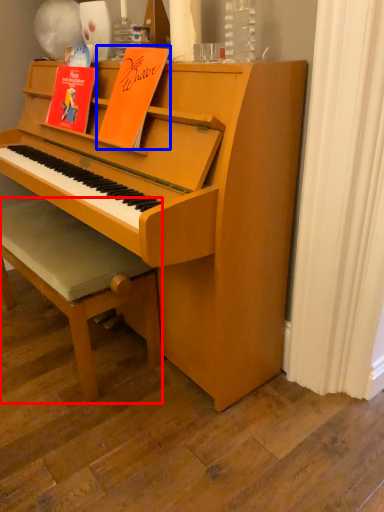
Question: Which of the following is the farthest to the observer, footrest (highlighted by a red box) or paperback book (highlighted by a blue box)?

Choices:
 (A) footrest
 (B) paperback book

Answer: (A)